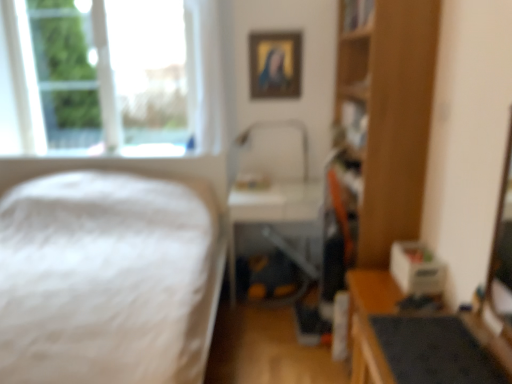
Question: From the image's perspective, would you say transparent glass window at upper left is positioned over metallic gray table at center?

Choices:
 (A) yes
 (B) no

Answer: (A)

Question: Is transparent glass window at upper left taller than metallic gray table at center?

Choices:
 (A) yes
 (B) no

Answer: (A)

Question: Considering the relative sizes of transparent glass window at upper left and metallic gray table at center in the image provided, is transparent glass window at upper left bigger than metallic gray table at center?

Choices:
 (A) no
 (B) yes

Answer: (A)

Question: Does transparent glass window at upper left have a greater width compared to metallic gray table at center?

Choices:
 (A) yes
 (B) no

Answer: (B)

Question: Is metallic gray table at center located within transparent glass window at upper left?

Choices:
 (A) no
 (B) yes

Answer: (A)

Question: From the image's perspective, is transparent glass window at upper left beneath metallic gray table at center?

Choices:
 (A) no
 (B) yes

Answer: (A)

Question: Is wooden table at lower right closer to the viewer compared to wooden bookshelf at right?

Choices:
 (A) yes
 (B) no

Answer: (A)

Question: Can you confirm if wooden table at lower right is bigger than wooden bookshelf at right?

Choices:
 (A) no
 (B) yes

Answer: (A)

Question: From the image's perspective, is wooden table at lower right above wooden bookshelf at right?

Choices:
 (A) yes
 (B) no

Answer: (B)

Question: Can you confirm if wooden table at lower right is taller than wooden bookshelf at right?

Choices:
 (A) yes
 (B) no

Answer: (B)

Question: Is there a large distance between wooden table at lower right and wooden bookshelf at right?

Choices:
 (A) no
 (B) yes

Answer: (A)

Question: Does wooden table at lower right have a smaller size compared to wooden bookshelf at right?

Choices:
 (A) yes
 (B) no

Answer: (A)

Question: Is wooden bookshelf at right aimed at white fluffy bed at left?

Choices:
 (A) no
 (B) yes

Answer: (B)